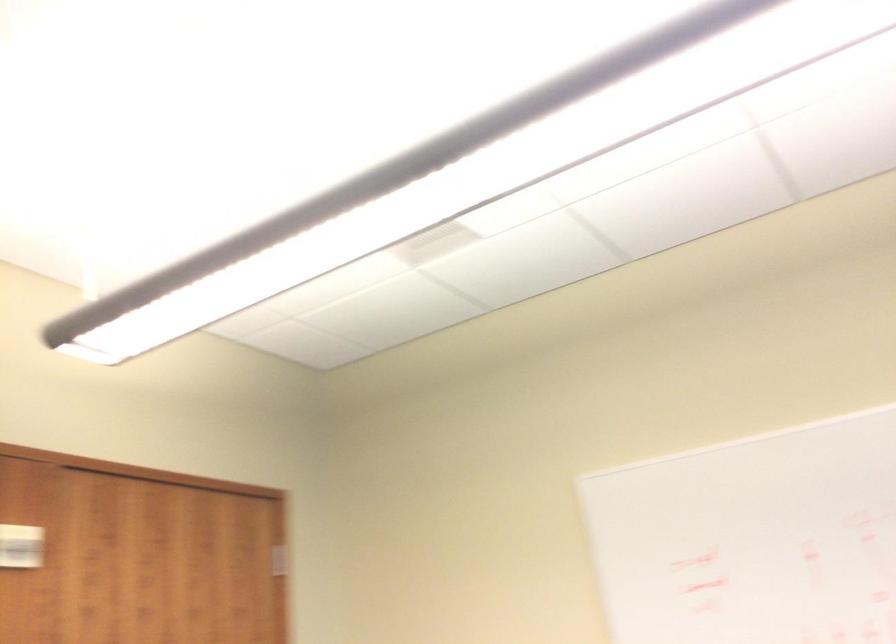
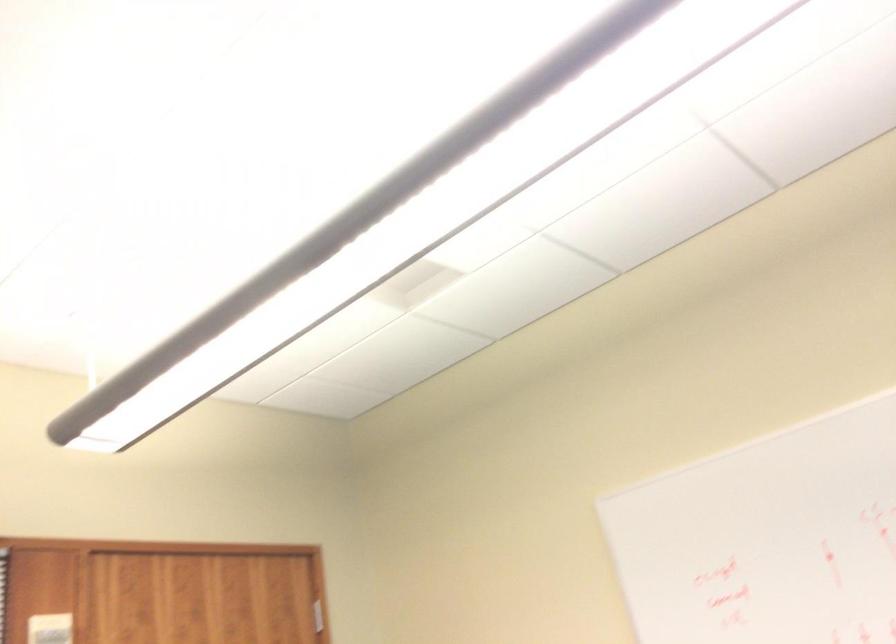
Question: The images are taken continuously from a first-person perspective. In which direction are you moving?

Choices:
 (A) Left
 (B) Right
 (C) Forward
 (D) Backward

Answer: (B)